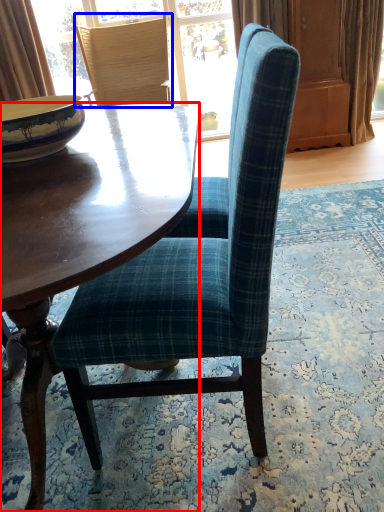
Question: Which object appears closest to the camera in this image, coffee table (highlighted by a red box) or chair (highlighted by a blue box)?

Choices:
 (A) coffee table
 (B) chair

Answer: (A)